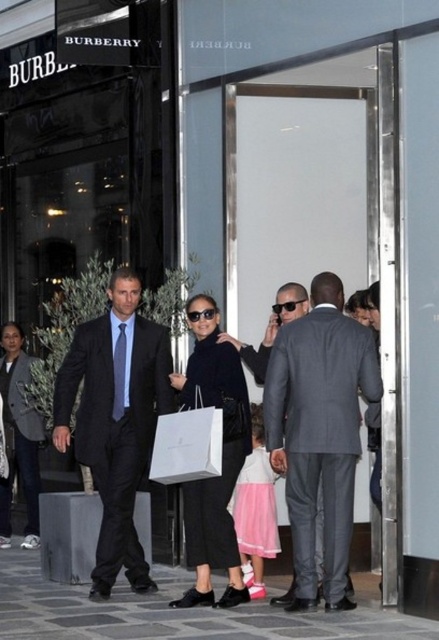
Based on the photo, you are a fashion designer observing the scene outside the Burberry store. You notice the dark gray textured suit at left and the matte black tie at left. Which of these two items is wider?

The dark gray textured suit at left is wider than the matte black tie at left according to the description.